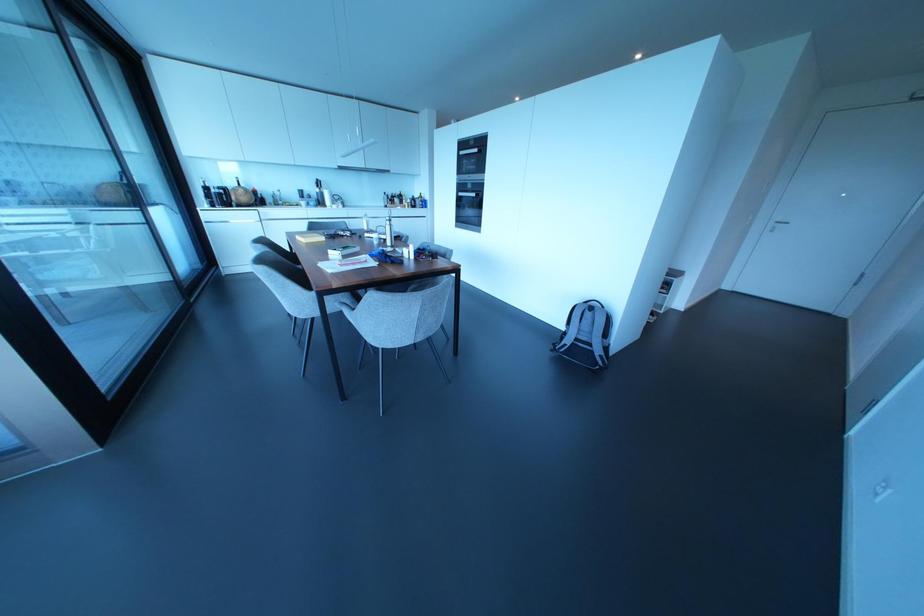
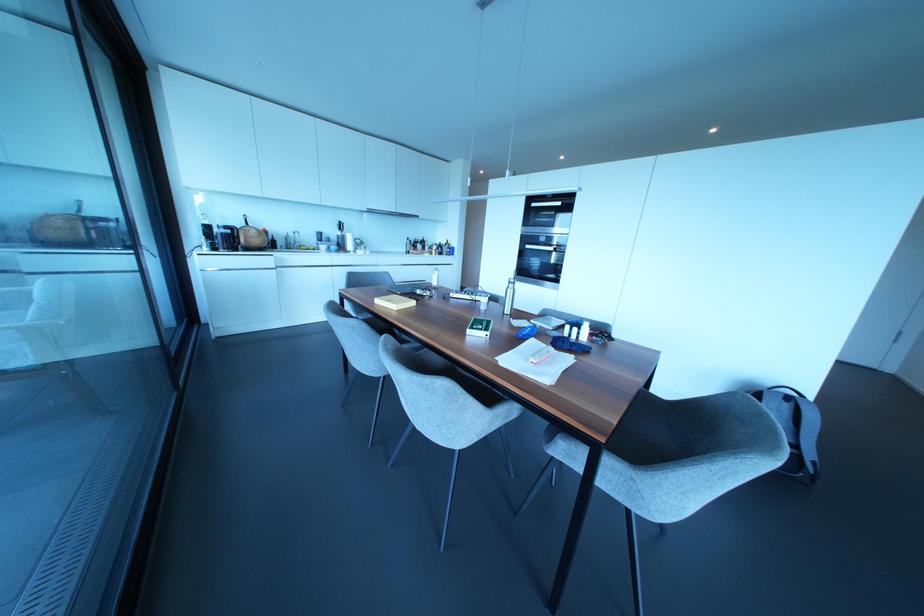
Where in the second image is the point corresponding to pixel 388 243 from the first image?

(506, 310)